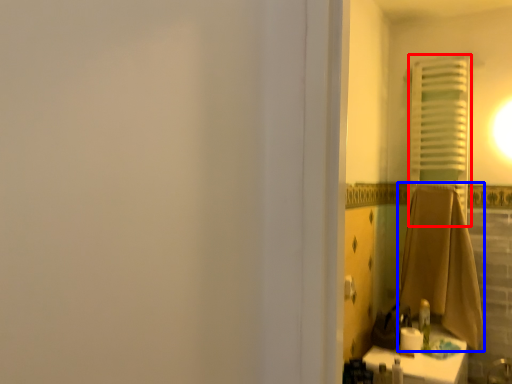
Question: Among these objects, which one is nearest to the camera, curtain (highlighted by a red box) or bath towel (highlighted by a blue box)?

Choices:
 (A) curtain
 (B) bath towel

Answer: (B)